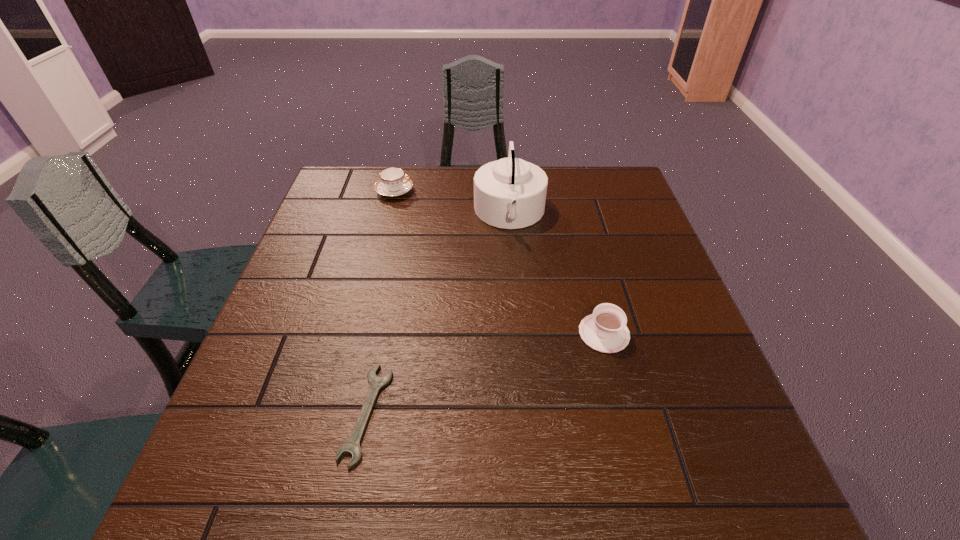
Where is `vacant space that satisfies the following two spatial constraints: 1. on the handle side of the nearer teacup; 2. on the spout of the kettle`? Image resolution: width=960 pixels, height=540 pixels. vacant space that satisfies the following two spatial constraints: 1. on the handle side of the nearer teacup; 2. on the spout of the kettle is located at coordinates (573, 213).

Identify the location of free space that satisfies the following two spatial constraints: 1. on the handle side of the rightmost object; 2. on the side with the handle of the farther teacup. The height and width of the screenshot is (540, 960). (567, 191).

Locate an element on the screen. The image size is (960, 540). vacant region that satisfies the following two spatial constraints: 1. on the side with the handle of the farther teacup; 2. on the handle side of the right teacup is located at coordinates (359, 333).

The width and height of the screenshot is (960, 540). Identify the location of blank area in the image that satisfies the following two spatial constraints: 1. on the back side of the wrench; 2. on the side with the handle of the left teacup. (412, 191).

Locate an element on the screen. vacant region that satisfies the following two spatial constraints: 1. on the side with the handle of the left teacup; 2. on the right side of the nearest object is located at coordinates (339, 414).

You are a GUI agent. You are given a task and a screenshot of the screen. Output one action in this format:
    pyautogui.click(x=<x>, y=<y>)
    Task: Click on the vacant region that satisfies the following two spatial constraints: 1. on the side with the handle of the nearest object; 2. on the right side of the farther teacup
    This screenshot has height=540, width=960.
    Given the screenshot: What is the action you would take?
    pyautogui.click(x=339, y=414)

This screenshot has width=960, height=540. Identify the location of free location that satisfies the following two spatial constraints: 1. on the side with the handle of the farther teacup; 2. on the handle side of the rightmost object. (359, 333).

Where is `vacant area that satisfies the following two spatial constraints: 1. on the side with the handle of the left teacup; 2. on the handle side of the second nearest object`? This screenshot has width=960, height=540. vacant area that satisfies the following two spatial constraints: 1. on the side with the handle of the left teacup; 2. on the handle side of the second nearest object is located at coordinates (359, 333).